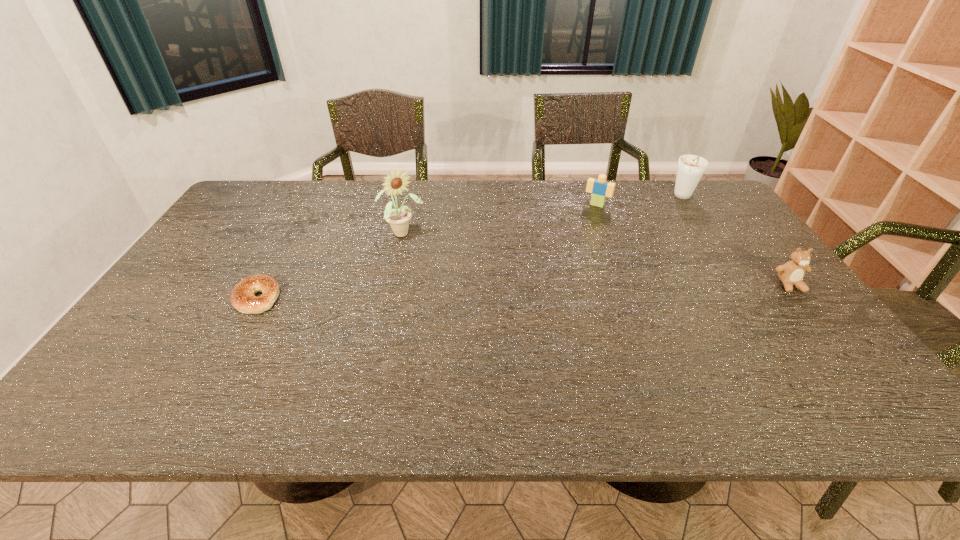
The image size is (960, 540). Identify the location of vacant space on the desktop that is between the shortest object and the teddy bear and is positioned on the face of the third object from right to left. (548, 291).

This screenshot has height=540, width=960. What are the coordinates of `vacant space on the desktop that is between the shortest object and the rightmost object and is positioned on the drink side of the root beer` in the screenshot? It's located at (594, 290).

Find the location of a particular element. vacant space on the desktop that is between the bagel and the teddy bear and is positioned on the front-facing side of the tallest object is located at coordinates (456, 293).